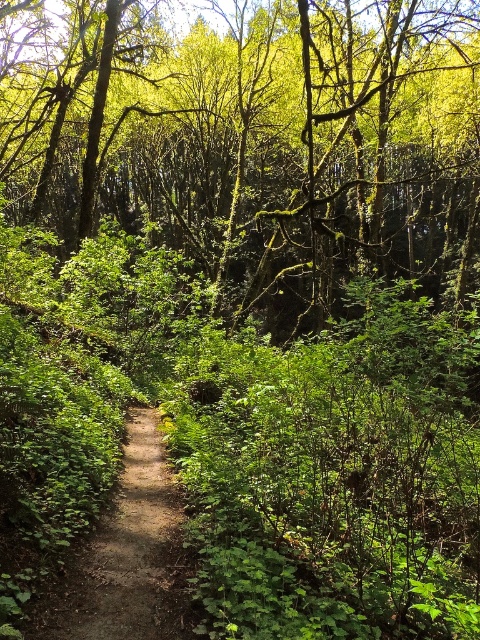
Between green leafy tree at center and dirt path at center, which one has more height?

green leafy tree at center is taller.

Does green leafy tree at center lie in front of dirt path at center?

No, it is behind dirt path at center.

I want to click on green leafy tree at center, so click(x=254, y=140).